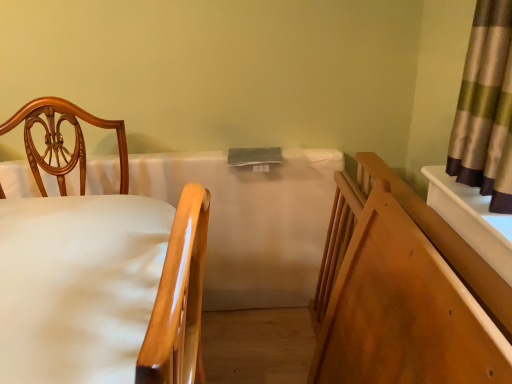
Question: Is wooden bed frame at right surrounding wooden chair at left?

Choices:
 (A) no
 (B) yes

Answer: (A)

Question: Can you confirm if wooden bed frame at right is shorter than wooden chair at left?

Choices:
 (A) no
 (B) yes

Answer: (B)

Question: Is wooden bed frame at right not close to wooden chair at left?

Choices:
 (A) yes
 (B) no

Answer: (B)

Question: Could you tell me if wooden bed frame at right is turned towards wooden chair at left?

Choices:
 (A) yes
 (B) no

Answer: (A)

Question: Is wooden bed frame at right not within wooden chair at left?

Choices:
 (A) yes
 (B) no

Answer: (A)

Question: From the image's perspective, does wooden bed frame at right appear lower than wooden chair at left?

Choices:
 (A) yes
 (B) no

Answer: (A)

Question: Considering the relative sizes of wooden bed frame at right and white fabric mattress at center in the image provided, is wooden bed frame at right bigger than white fabric mattress at center?

Choices:
 (A) yes
 (B) no

Answer: (B)

Question: From the image's perspective, is wooden bed frame at right above white fabric mattress at center?

Choices:
 (A) no
 (B) yes

Answer: (A)

Question: Is wooden bed frame at right far from white fabric mattress at center?

Choices:
 (A) yes
 (B) no

Answer: (B)

Question: Considering the relative sizes of wooden bed frame at right and white fabric mattress at center in the image provided, is wooden bed frame at right taller than white fabric mattress at center?

Choices:
 (A) yes
 (B) no

Answer: (B)

Question: From the image's perspective, would you say wooden bed frame at right is shown under white fabric mattress at center?

Choices:
 (A) yes
 (B) no

Answer: (A)

Question: Considering the relative sizes of wooden bed frame at right and white fabric mattress at center in the image provided, is wooden bed frame at right wider than white fabric mattress at center?

Choices:
 (A) no
 (B) yes

Answer: (B)

Question: Is the surface of wooden chair at left in direct contact with wooden bed frame at right?

Choices:
 (A) yes
 (B) no

Answer: (B)